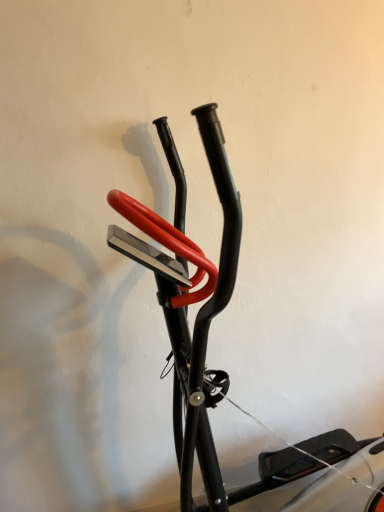
This screenshot has height=512, width=384. Describe the element at coordinates (222, 370) in the screenshot. I see `matte black handlebars at center` at that location.

The width and height of the screenshot is (384, 512). What are the coordinates of `matte black handlebars at center` in the screenshot? It's located at (222, 370).

In order to click on matte black handlebars at center in this screenshot , I will do `click(222, 370)`.